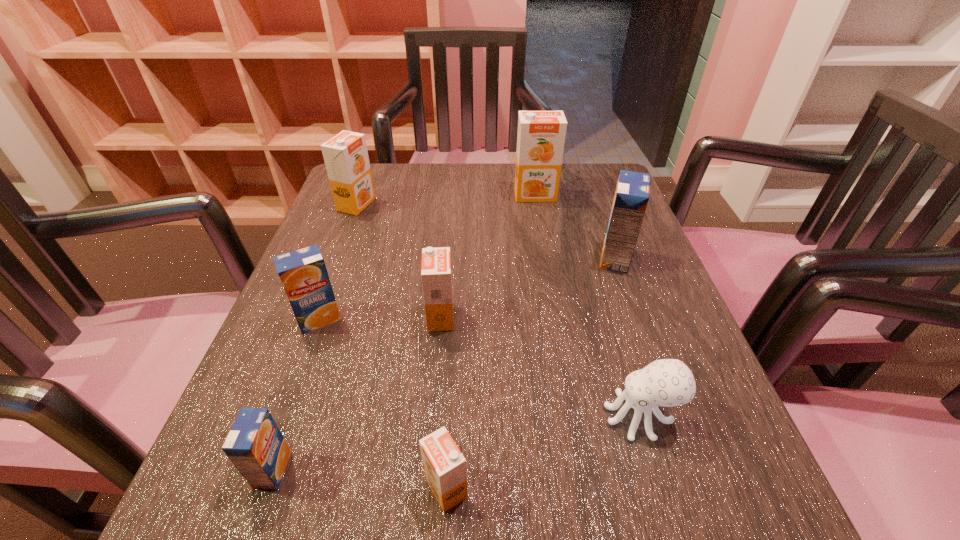
At what (x,y) coordinates should I click in order to perform the action: click on the rightmost orange orange juice. Please return your answer as a coordinate pair (x, y). Image resolution: width=960 pixels, height=540 pixels. Looking at the image, I should click on (541, 135).

Find the location of a particular element. This screenshot has height=540, width=960. the biggest orange orange juice is located at coordinates tap(541, 135).

Where is `the leftmost orange orange juice`? This screenshot has width=960, height=540. the leftmost orange orange juice is located at coordinates (346, 158).

Where is `the rightmost orange_juice`? This screenshot has height=540, width=960. the rightmost orange_juice is located at coordinates (631, 197).

Image resolution: width=960 pixels, height=540 pixels. Identify the location of the third farthest object. (631, 197).

You are a GUI agent. You are given a task and a screenshot of the screen. Output one action in this format:
    pyautogui.click(x=<x>, y=<y>)
    Task: Click on the second nearest orange orange juice
    This screenshot has width=960, height=540.
    Given the screenshot: What is the action you would take?
    pyautogui.click(x=436, y=275)

Image resolution: width=960 pixels, height=540 pixels. In order to click on the second farthest blue orange_juice in this screenshot , I will do `click(303, 273)`.

At what (x,y) coordinates should I click in order to perform the action: click on white octopus. Please return your answer as a coordinate pair (x, y). This screenshot has height=540, width=960. Looking at the image, I should click on (667, 382).

Where is `octopus`? This screenshot has height=540, width=960. octopus is located at coordinates (667, 382).

Locate an element on the screen. This screenshot has height=540, width=960. the nearest orange orange juice is located at coordinates (444, 465).